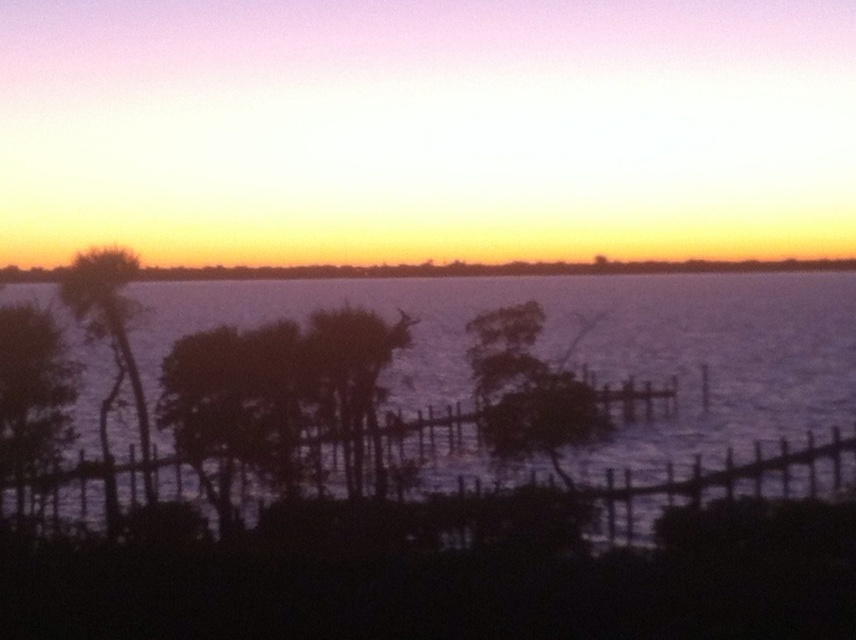
Question: Is silhouette wood tree at center closer to camera compared to silhouette palm tree at left?

Choices:
 (A) yes
 (B) no

Answer: (A)

Question: Which of the following is the farthest from the observer?

Choices:
 (A) silhouette palm tree at left
 (B) silhouette wood tree at center
 (C) dark green leafy tree at left

Answer: (A)

Question: Is dark green leafy tree at left to the left of silhouette palm tree at left from the viewer's perspective?

Choices:
 (A) no
 (B) yes

Answer: (B)

Question: Considering the relative positions of orange sky at upper center and silhouette wood tree at center in the image provided, where is orange sky at upper center located with respect to silhouette wood tree at center?

Choices:
 (A) right
 (B) left

Answer: (B)

Question: Which point appears farthest from the camera in this image?

Choices:
 (A) [x=3, y=273]
 (B) [x=325, y=316]
 (C) [x=837, y=404]

Answer: (A)

Question: Which of the following is the farthest from the observer?

Choices:
 (A) (312, 344)
 (B) (90, 253)

Answer: (B)